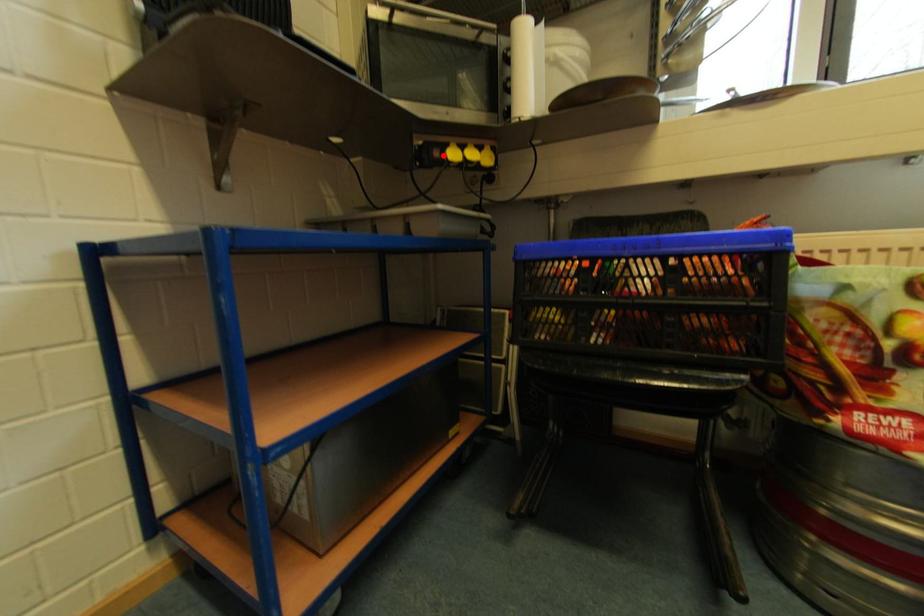
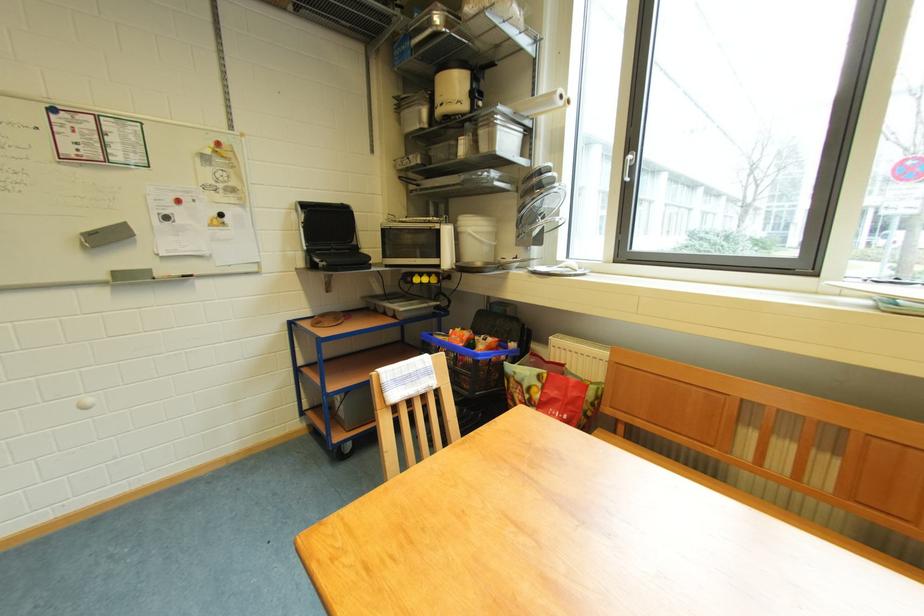
The point at the highlighted location is marked in the first image. Where is the corresponding point in the second image?

(417, 282)